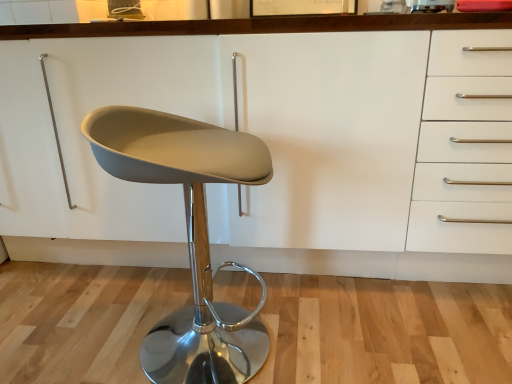
Describe the element at coordinates (189, 236) in the screenshot. I see `matte gray seat at center` at that location.

Measure the distance between point (229,265) and camera.

They are 5.22 feet apart.

I want to click on matte gray seat at center, so click(x=189, y=236).

What do you see at coordinates (273, 144) in the screenshot? I see `white matte cabinet at center` at bounding box center [273, 144].

What is the approximate width of white matte cabinet at center?

65.11 centimeters.

Find the location of a particular element. This screenshot has width=512, height=384. white matte cabinet at center is located at coordinates (273, 144).

What is the approximate height of white matte cabinet at center?

It is 36.73 inches.

Locate an element on the screen. Image resolution: width=512 pixels, height=384 pixels. matte gray seat at center is located at coordinates (189, 236).

Does white matte cabinet at center appear on the left side of matte gray seat at center?

Incorrect, white matte cabinet at center is not on the left side of matte gray seat at center.

Is white matte cabinet at center closer to the viewer compared to matte gray seat at center?

No, white matte cabinet at center is behind matte gray seat at center.

Does point (91, 260) come behind point (185, 143)?

Yes, point (91, 260) is farther from viewer.

From the image's perspective, is white matte cabinet at center above matte gray seat at center?

Indeed, from the image's perspective, white matte cabinet at center is shown above matte gray seat at center.

From a real-world perspective, who is located lower, white matte cabinet at center or matte gray seat at center?

matte gray seat at center.

Is white matte cabinet at center wider than matte gray seat at center?

Correct, the width of white matte cabinet at center exceeds that of matte gray seat at center.

Which of these two, white matte cabinet at center or matte gray seat at center, stands shorter?

With less height is matte gray seat at center.

Looking at this image, can you confirm if white matte cabinet at center is smaller than matte gray seat at center?

Actually, white matte cabinet at center might be larger than matte gray seat at center.

Would you say matte gray seat at center is part of white matte cabinet at center's contents?

No, matte gray seat at center is not a part of white matte cabinet at center.

Are white matte cabinet at center and matte gray seat at center making contact?

There is a gap between white matte cabinet at center and matte gray seat at center.

Could you tell me if white matte cabinet at center is turned towards matte gray seat at center?

Yes, white matte cabinet at center faces towards matte gray seat at center.

What's the angular difference between white matte cabinet at center and matte gray seat at center's facing directions?

99.2 degrees separate the facing orientations of white matte cabinet at center and matte gray seat at center.

Image resolution: width=512 pixels, height=384 pixels. Identify the location of cabinetry above the matte gray seat at center (from the image's perspective). (273, 144).

Which is more to the right, matte gray seat at center or white matte cabinet at center?

Positioned to the right is white matte cabinet at center.

Is matte gray seat at center further to camera compared to white matte cabinet at center?

No, matte gray seat at center is closer to the viewer.

Considering the points (114, 113) and (95, 27), which point is in front, point (114, 113) or point (95, 27)?

The point (114, 113) is closer.

From the image's perspective, who appears lower, matte gray seat at center or white matte cabinet at center?

matte gray seat at center, from the image's perspective.

From a real-world perspective, which is physically below, matte gray seat at center or white matte cabinet at center?

In real-world perspective, matte gray seat at center is lower.

Is matte gray seat at center thinner than white matte cabinet at center?

Correct, the width of matte gray seat at center is less than that of white matte cabinet at center.

Considering the sizes of matte gray seat at center and white matte cabinet at center in the image, is matte gray seat at center taller or shorter than white matte cabinet at center?

matte gray seat at center is shorter than white matte cabinet at center.

Is matte gray seat at center bigger or smaller than white matte cabinet at center?

In the image, matte gray seat at center appears to be smaller than white matte cabinet at center.

Is matte gray seat at center inside or outside of white matte cabinet at center?

matte gray seat at center is spatially situated outside white matte cabinet at center.

Are matte gray seat at center and white matte cabinet at center making contact?

No, matte gray seat at center is not with white matte cabinet at center.

Is matte gray seat at center facing away from white matte cabinet at center?

matte gray seat at center is not turned away from white matte cabinet at center.

Can you tell me how much matte gray seat at center and white matte cabinet at center differ in facing direction?

The angle between the facing direction of matte gray seat at center and the facing direction of white matte cabinet at center is 99.2 degrees.

Locate an element on the screen. The width and height of the screenshot is (512, 384). cabinetry above the matte gray seat at center (from the image's perspective) is located at coordinates (273, 144).

What are the coordinates of `cabinetry lying on the right of matte gray seat at center` in the screenshot? It's located at (273, 144).

You are a GUI agent. You are given a task and a screenshot of the screen. Output one action in this format:
    pyautogui.click(x=<x>, y=<y>)
    Task: Click on the cabinetry above the matte gray seat at center (from a real-world perspective)
    This screenshot has width=512, height=384.
    Given the screenshot: What is the action you would take?
    pyautogui.click(x=273, y=144)